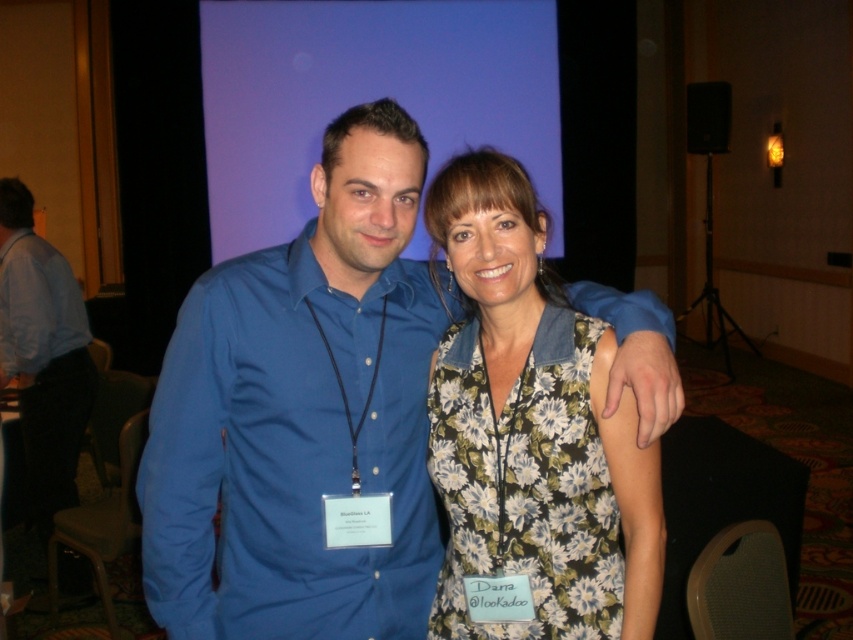
Does blue smooth shirt at center appear over floral fabric dress at center?

Yes, blue smooth shirt at center is above floral fabric dress at center.

Between blue smooth shirt at center and floral fabric dress at center, which one is positioned higher?

blue smooth shirt at center is higher up.

Where is `blue smooth shirt at center`? The width and height of the screenshot is (853, 640). blue smooth shirt at center is located at coordinates (x=303, y=416).

Does floral fabric dress at center appear over light blue cotton shirt at left?

No, floral fabric dress at center is not above light blue cotton shirt at left.

Between point (601, 449) and point (35, 276), which one is positioned in front?

Point (601, 449) is more forward.

At what (x,y) coordinates should I click in order to perform the action: click on floral fabric dress at center. Please return your answer as a coordinate pair (x, y). Looking at the image, I should click on (525, 484).

Which of these two, matte blue shirt at center or light blue cotton shirt at left, stands taller?

Standing taller between the two is matte blue shirt at center.

Does matte blue shirt at center have a larger size compared to light blue cotton shirt at left?

Yes.

Where is `matte blue shirt at center`? Image resolution: width=853 pixels, height=640 pixels. matte blue shirt at center is located at coordinates (289, 452).

I want to click on matte blue shirt at center, so click(289, 452).